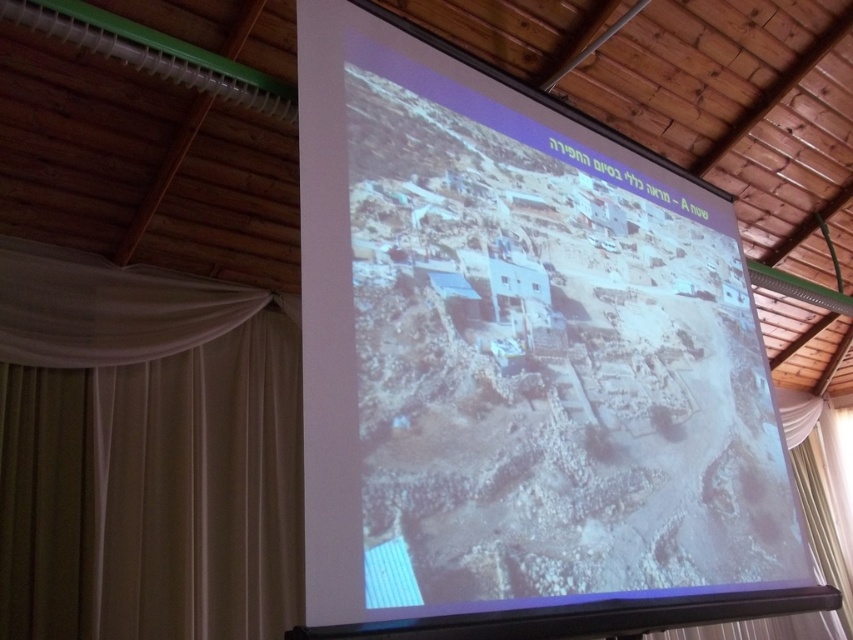
You are a stagehand who needs to move a 4 meter long ladder from the beige fabric curtain at left to the white sheer curtain at lower right. Is the space between them wide enough to move the ladder without tilting it?

The distance between the beige fabric curtain at left and white sheer curtain at lower right is 3.91 meters. Since the ladder is 4 meters long, the space is slightly too narrow to move it horizontally without tilting.

You are standing in the room where the presentation screen is displayed. You want to touch the gray stone wall at center shown on the screen. Can you reach it from where you are standing?

The gray stone wall at center is displayed on the screen, which is 1.27 meters away from you. Since the wall is part of the image on the screen and not a physical object in the room, you cannot physically touch it.

You are an architect reviewing a village layout displayed on a presentation screen. You notice the gray stone wall at center and the beige fabric curtain at left. Which object appears taller in the image?

The gray stone wall at center is taller than the beige fabric curtain at left according to the description.